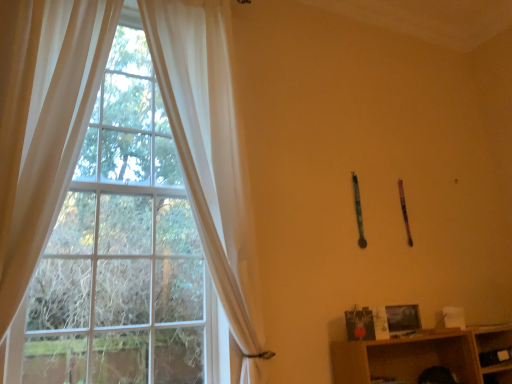
Question: Is white sheer curtain at left, acting as the first curtain starting from the right, to the right of white sheer curtain at left, which ranks as the first curtain in left-to-right order, from the viewer's perspective?

Choices:
 (A) yes
 (B) no

Answer: (A)

Question: Does white sheer curtain at left, arranged as the 2th curtain when viewed from the left, come in front of white sheer curtain at left, which ranks as the first curtain in left-to-right order?

Choices:
 (A) no
 (B) yes

Answer: (A)

Question: Does white sheer curtain at left, arranged as the 2th curtain when viewed from the left, have a lesser width compared to white sheer curtain at left, the 2th curtain from the right?

Choices:
 (A) no
 (B) yes

Answer: (B)

Question: Is white sheer curtain at left, acting as the first curtain starting from the right, turned away from white sheer curtain at left, the 2th curtain from the right?

Choices:
 (A) no
 (B) yes

Answer: (A)

Question: Is white sheer curtain at left, acting as the first curtain starting from the right, oriented towards white sheer curtain at left, the 2th curtain from the right?

Choices:
 (A) yes
 (B) no

Answer: (B)

Question: Is white sheer curtain at left, arranged as the 2th curtain when viewed from the left, outside of white sheer curtain at left, the 2th curtain from the right?

Choices:
 (A) yes
 (B) no

Answer: (A)

Question: From a real-world perspective, does white sheer curtain at left, which ranks as the first curtain in left-to-right order, sit lower than white sheer curtain at left, acting as the first curtain starting from the right?

Choices:
 (A) yes
 (B) no

Answer: (A)

Question: From a real-world perspective, is white sheer curtain at left, the 2th curtain from the right, on top of white sheer curtain at left, arranged as the 2th curtain when viewed from the left?

Choices:
 (A) no
 (B) yes

Answer: (A)

Question: From the image's perspective, is white sheer curtain at left, the 2th curtain from the right, under white sheer curtain at left, arranged as the 2th curtain when viewed from the left?

Choices:
 (A) no
 (B) yes

Answer: (B)

Question: Considering the relative sizes of white sheer curtain at left, the 2th curtain from the right, and white sheer curtain at left, acting as the first curtain starting from the right, in the image provided, is white sheer curtain at left, the 2th curtain from the right, thinner than white sheer curtain at left, acting as the first curtain starting from the right,?

Choices:
 (A) yes
 (B) no

Answer: (B)

Question: Is white sheer curtain at left, the 2th curtain from the right, at the left side of white sheer curtain at left, arranged as the 2th curtain when viewed from the left?

Choices:
 (A) no
 (B) yes

Answer: (B)

Question: Does white sheer curtain at left, the 2th curtain from the right, have a lesser height compared to white sheer curtain at left, arranged as the 2th curtain when viewed from the left?

Choices:
 (A) yes
 (B) no

Answer: (A)

Question: In the image, is white sheer curtain at left, arranged as the 2th curtain when viewed from the left, positioned in front of or behind white sheer curtain at left, the 2th curtain from the right?

Choices:
 (A) front
 (B) behind

Answer: (B)